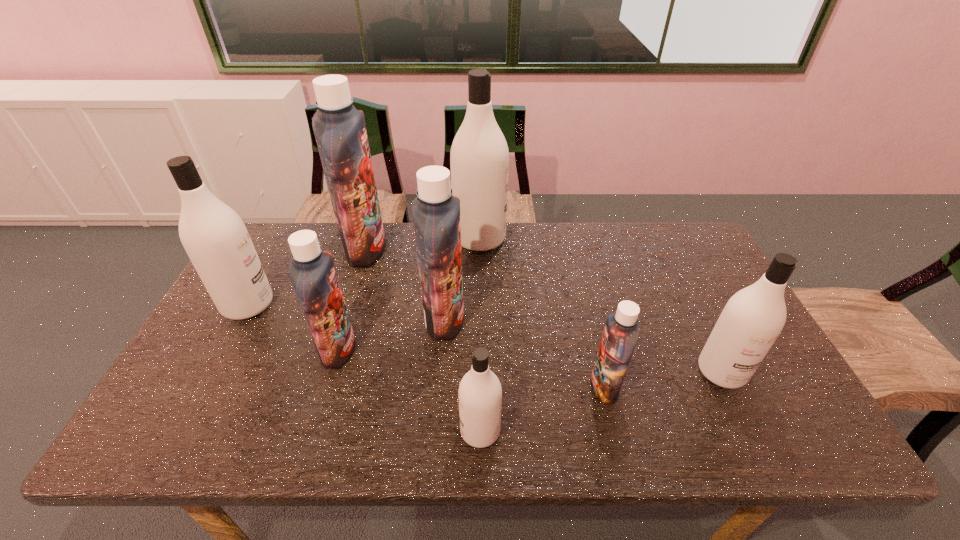
Find the location of `the farthest blue shampoo`. the farthest blue shampoo is located at coordinates (339, 128).

Identify the location of the biggest white shampoo. This screenshot has width=960, height=540. (479, 159).

In order to click on the third smallest white shampoo in this screenshot , I will do `click(214, 236)`.

The image size is (960, 540). What are the coordinates of `the leftmost object` in the screenshot? It's located at (214, 236).

This screenshot has width=960, height=540. What are the coordinates of `the second blue shampoo from right to left` in the screenshot? It's located at (436, 212).

Find the location of a particular element. The image size is (960, 540). the third biggest blue shampoo is located at coordinates (312, 272).

The height and width of the screenshot is (540, 960). What are the coordinates of `the rightmost shampoo` in the screenshot? It's located at (753, 318).

Locate an element on the screen. The height and width of the screenshot is (540, 960). the third farthest white shampoo is located at coordinates (753, 318).

Identify the location of the seventh shampoo from left to right. The height and width of the screenshot is (540, 960). (621, 332).

The height and width of the screenshot is (540, 960). I want to click on the seventh object from left to right, so click(621, 332).